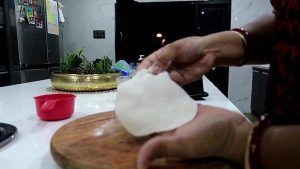
Locate an element on the screen. red cup on counter is located at coordinates (63, 102).